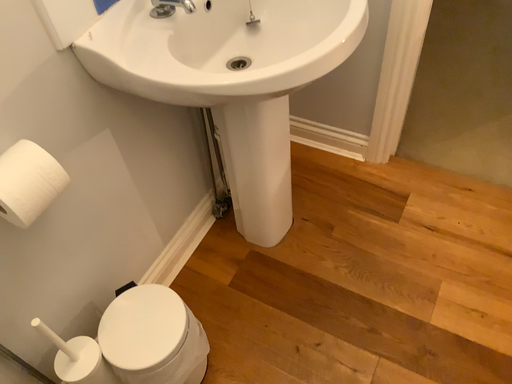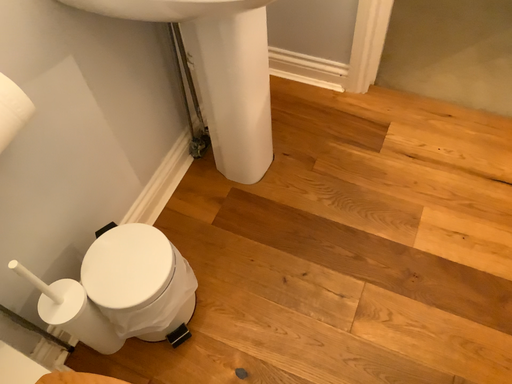
Question: Which way did the camera rotate in the video?

Choices:
 (A) rotated upward
 (B) rotated downward

Answer: (B)